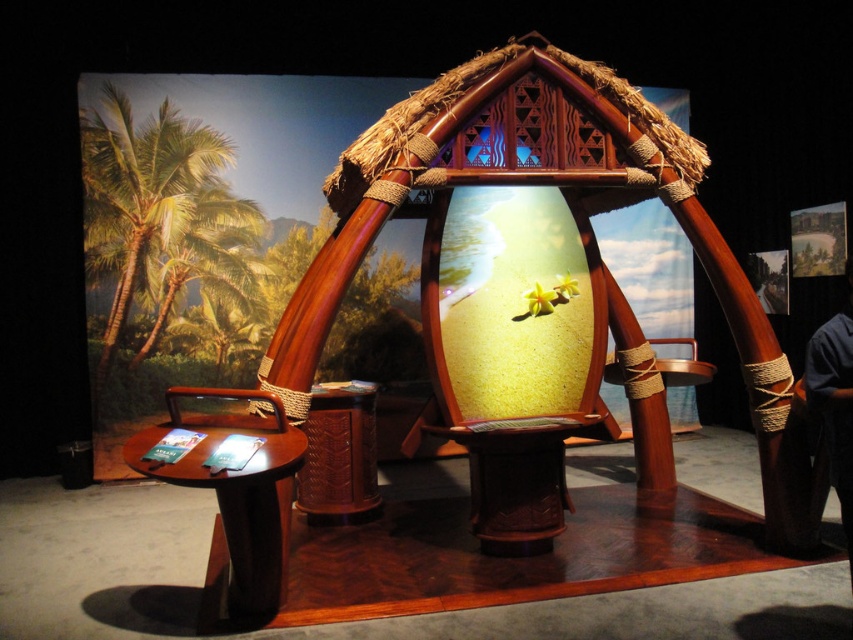
Which is behind, point (160, 268) or point (846, 488)?

Point (160, 268)

Who is shorter, green leafy palm tree at left or dark blue shirt at right?

With less height is dark blue shirt at right.

Identify the location of green leafy palm tree at left. (160, 221).

Image resolution: width=853 pixels, height=640 pixels. In order to click on green leafy palm tree at left in this screenshot , I will do `click(160, 221)`.